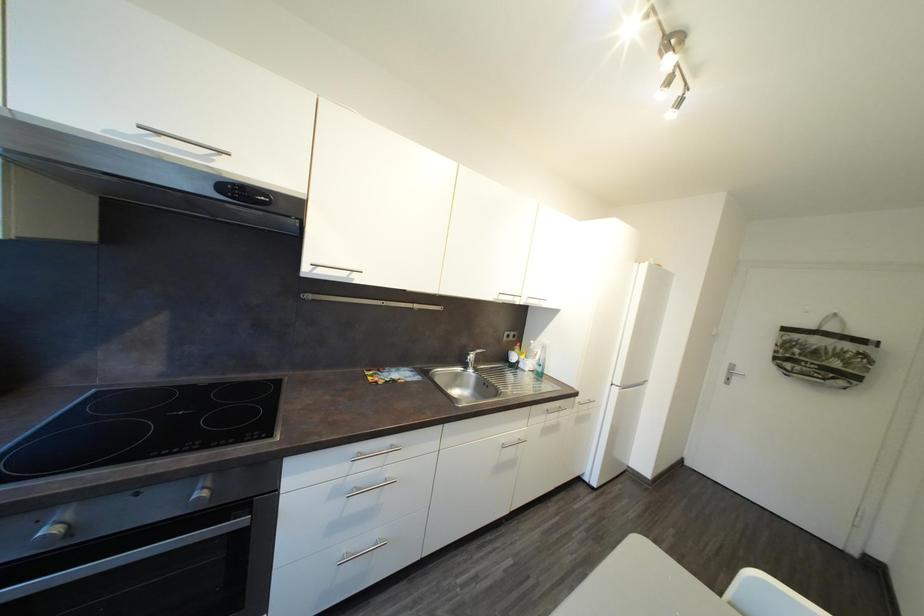
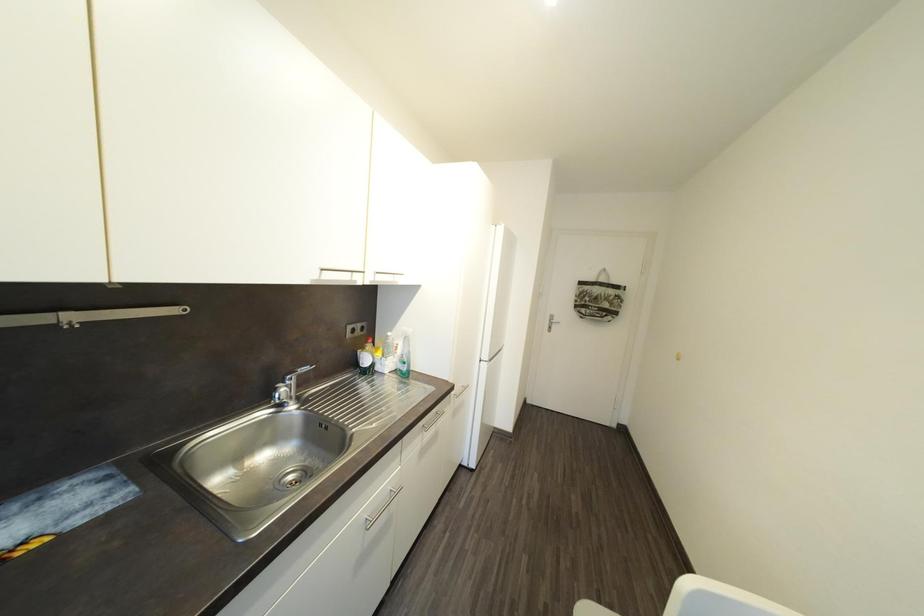
Question: The images are taken continuously from a first-person perspective. In which direction is your viewpoint rotating?

Choices:
 (A) Left
 (B) Right
 (C) Up
 (D) Down

Answer: (B)